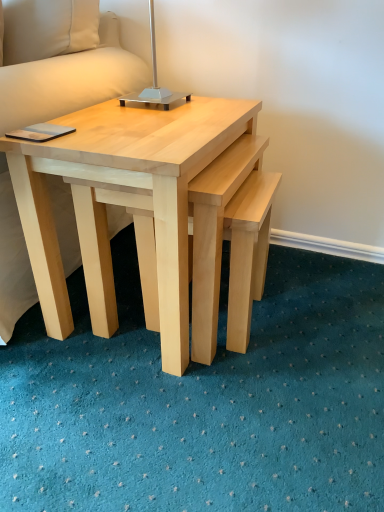
Identify the location of vacant area that lies to the right of natural wood coffee table at center. This screenshot has height=512, width=384. (321, 319).